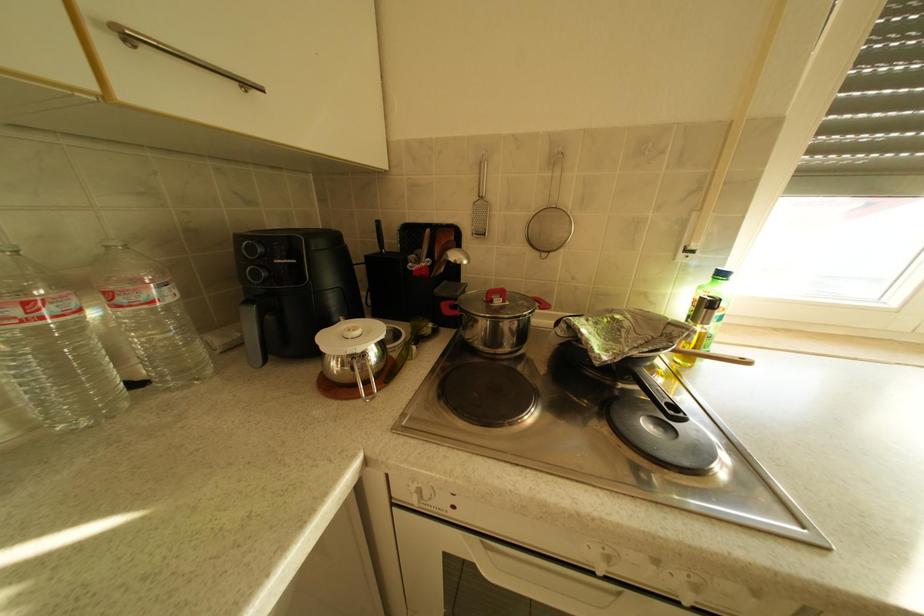
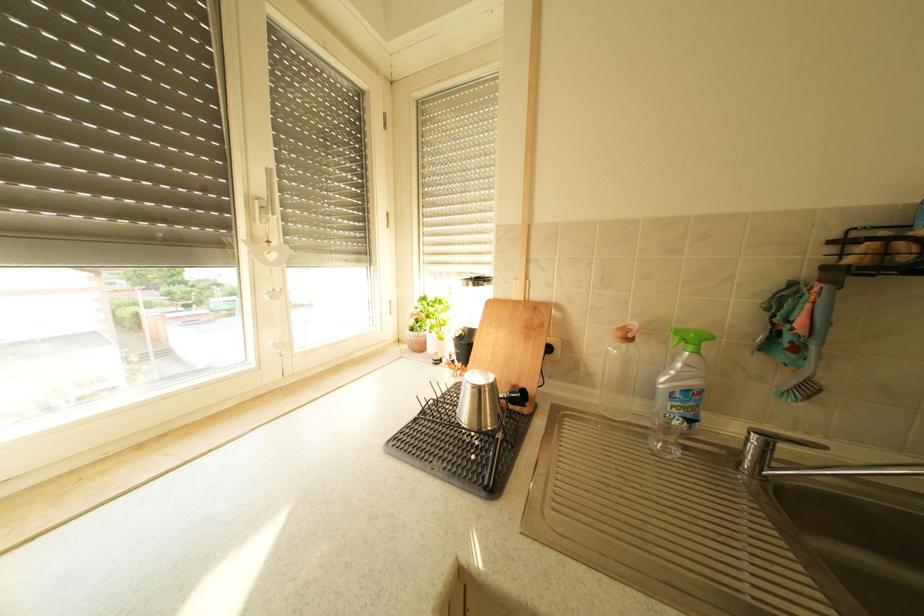
Question: The images are taken continuously from a first-person perspective. In which direction is your viewpoint rotating?

Choices:
 (A) Left
 (B) Right
 (C) Up
 (D) Down

Answer: (B)